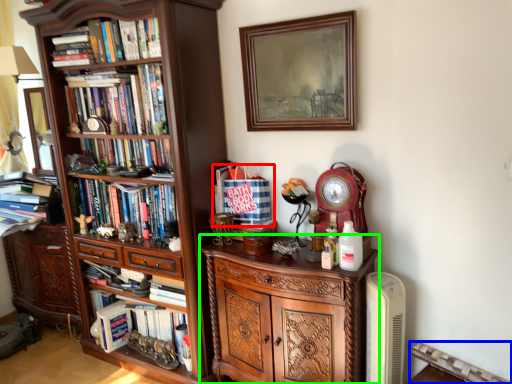
Question: Estimate the real-world distances between objects in this image. Which object is closer to book (highlighted by a red box), radiator (highlighted by a blue box) or cabinetry (highlighted by a green box)?

Choices:
 (A) radiator
 (B) cabinetry

Answer: (B)